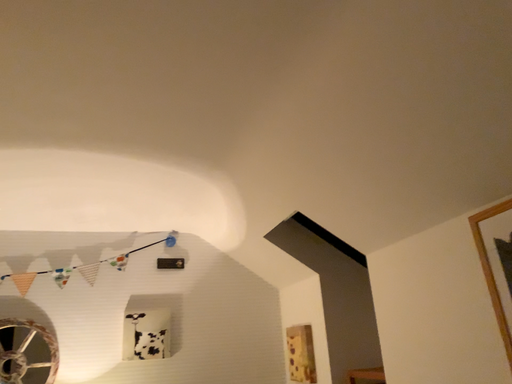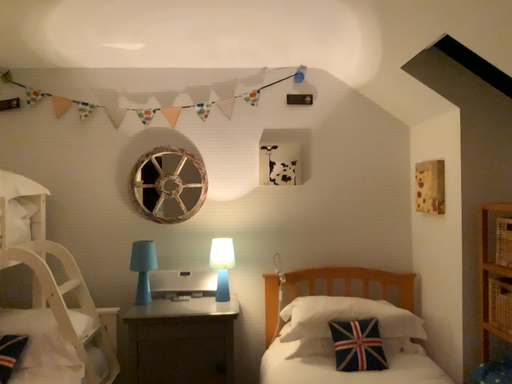
Question: Which way did the camera rotate in the video?

Choices:
 (A) rotated downward
 (B) rotated upward

Answer: (A)